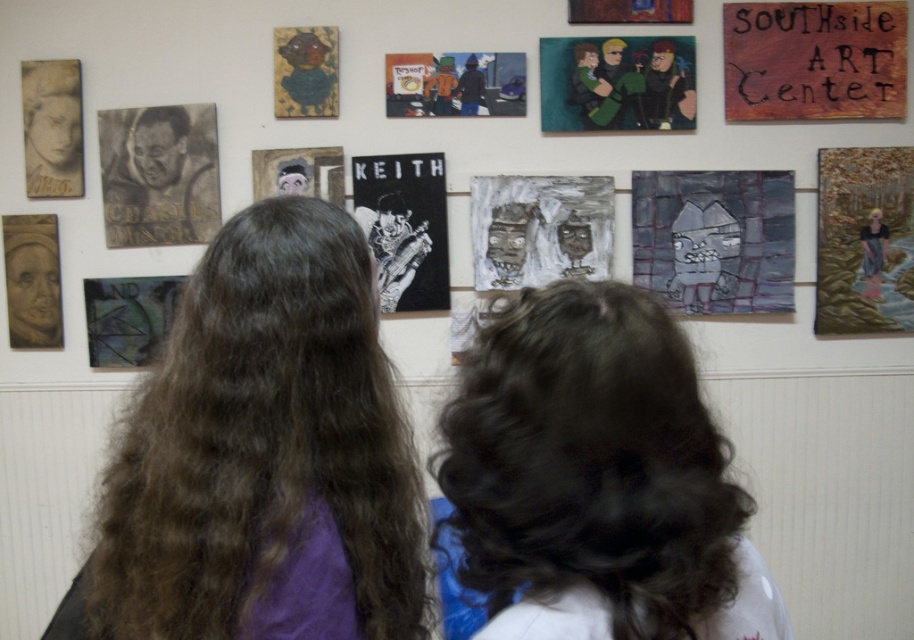
You are an art critic analyzing the artwork arrangement in the scene. Which artwork is larger between the pastel watercolor landscape at upper right and the textured gray painting of two faces at center?

The textured gray painting of two faces at center is larger than the pastel watercolor landscape at upper right.

You are standing in front of the wall with the two people. You want to read the wooden sign at upper right without moving your feet. Can you reach it by stretching your arm out fully?

The wooden sign at upper right is 8.75 feet away from viewer. Since the average human arm length is about 2.5 feet, you cannot reach it by stretching your arm out fully.